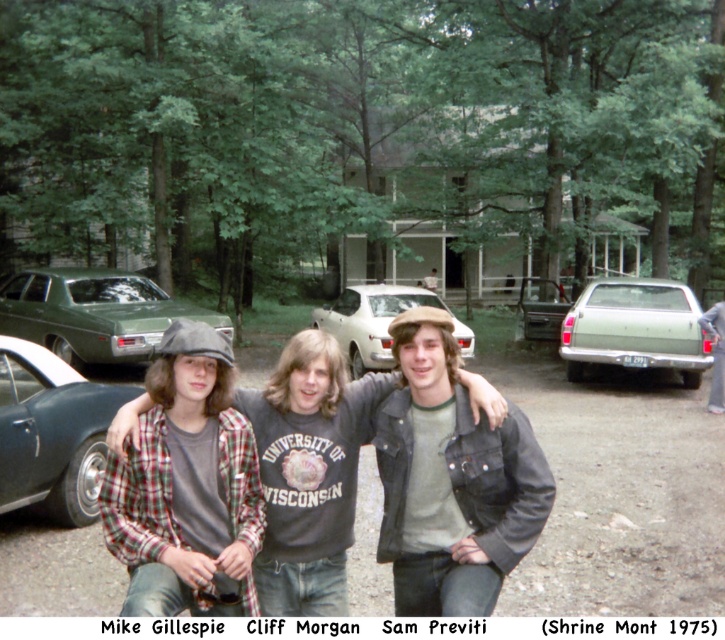
Between plaid flannel shirt at center and gray denim jacket at right, which one appears on the right side from the viewer's perspective?

gray denim jacket at right is more to the right.

Where is `plaid flannel shirt at center`? plaid flannel shirt at center is located at coordinates (186, 486).

Between point (165, 488) and point (718, 410), which one is positioned behind?

The point (718, 410) is more distant.

Find the location of a particular element. plaid flannel shirt at center is located at coordinates (186, 486).

Does point (204, 404) lie behind point (683, 365)?

No, it is not.

Which is more to the right, plaid flannel shirt at center or light green matte sedan at right?

From the viewer's perspective, light green matte sedan at right appears more on the right side.

The width and height of the screenshot is (725, 640). What do you see at coordinates (186, 486) in the screenshot? I see `plaid flannel shirt at center` at bounding box center [186, 486].

Where is `plaid flannel shirt at center`? The width and height of the screenshot is (725, 640). plaid flannel shirt at center is located at coordinates (186, 486).

Who is higher up, white glossy sedan at center or gray denim jacket at right?

Positioned higher is white glossy sedan at center.

Which of these two, white glossy sedan at center or gray denim jacket at right, stands taller?

Standing taller between the two is white glossy sedan at center.

The width and height of the screenshot is (725, 640). Find the location of `white glossy sedan at center`. white glossy sedan at center is located at coordinates (368, 321).